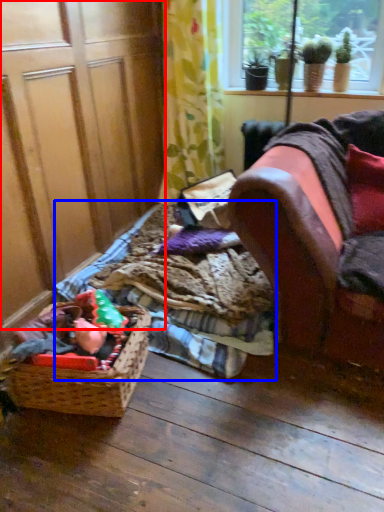
Question: Which object appears closest to the camera in this image, screen door (highlighted by a red box) or bedding (highlighted by a blue box)?

Choices:
 (A) screen door
 (B) bedding

Answer: (A)